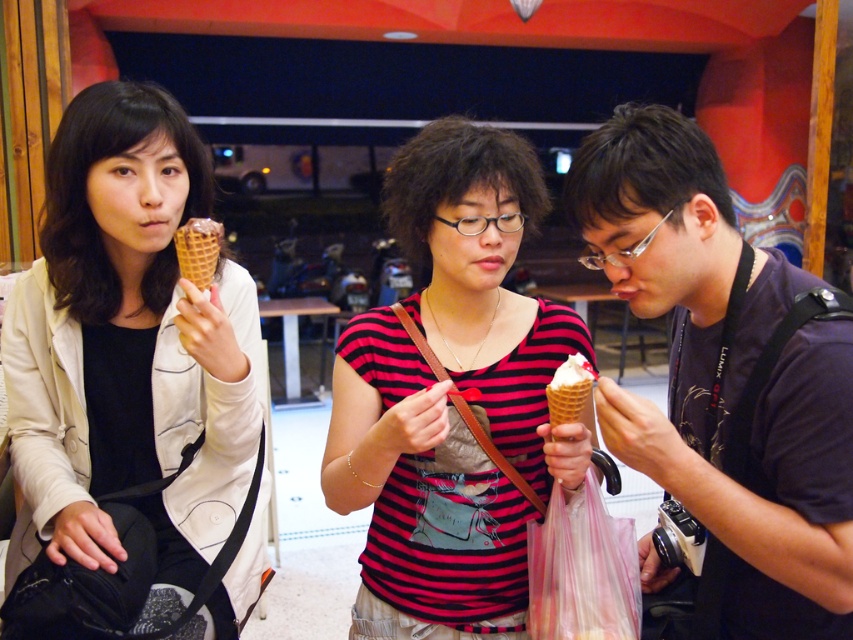
Can you confirm if matte black shirt at center is thinner than chocolate waffle cone at left?

In fact, matte black shirt at center might be wider than chocolate waffle cone at left.

Who is more forward, (x=740, y=524) or (x=180, y=262)?

Point (x=740, y=524)

Image resolution: width=853 pixels, height=640 pixels. I want to click on matte black shirt at center, so click(x=726, y=380).

Does matte brown ice cream cone at left appear on the left side of white creamy ice cream at center?

Yes, matte brown ice cream cone at left is to the left of white creamy ice cream at center.

What are the coordinates of `matte brown ice cream cone at left` in the screenshot? It's located at (126, 346).

Is chocolate waffle cone at left taller than white creamy ice cream at center?

Yes, chocolate waffle cone at left is taller than white creamy ice cream at center.

Is chocolate waffle cone at left thinner than white creamy ice cream at center?

In fact, chocolate waffle cone at left might be wider than white creamy ice cream at center.

Does point (196, 236) come behind point (582, 400)?

Yes, it is behind point (582, 400).

The height and width of the screenshot is (640, 853). Identify the location of chocolate waffle cone at left. (198, 250).